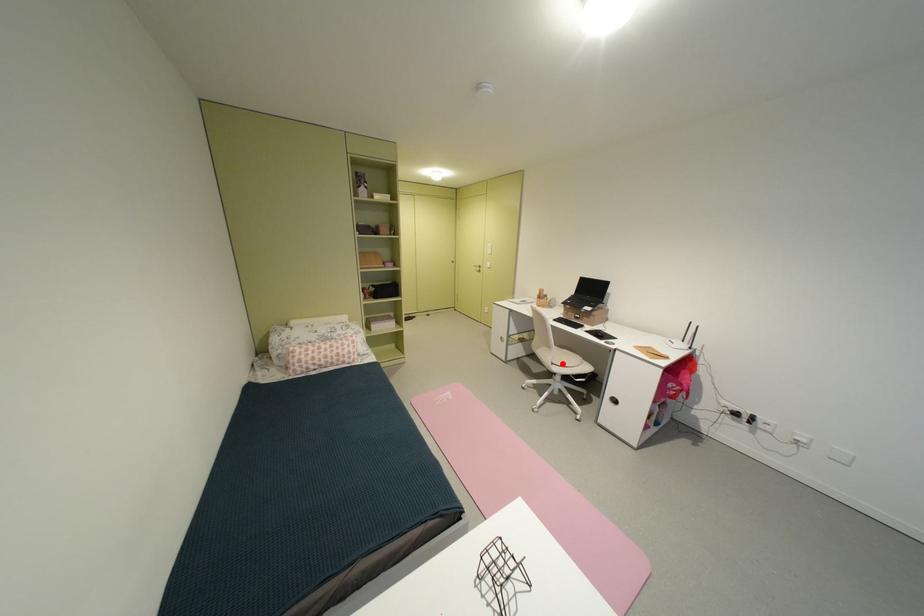
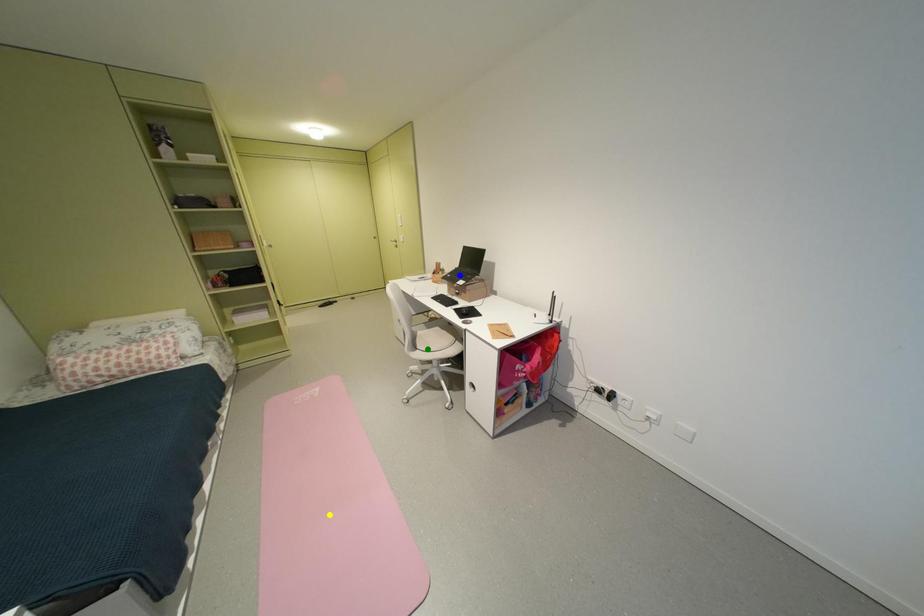
Question: I am providing you with two images of the same scene from different viewpoints. A red point is marked on the first image. You are given multiple points on the second image. Which point in image 2 is actually the same real-world point as the red point in image 1?

Choices:
 (A) green point
 (B) blue point
 (C) yellow point

Answer: (A)